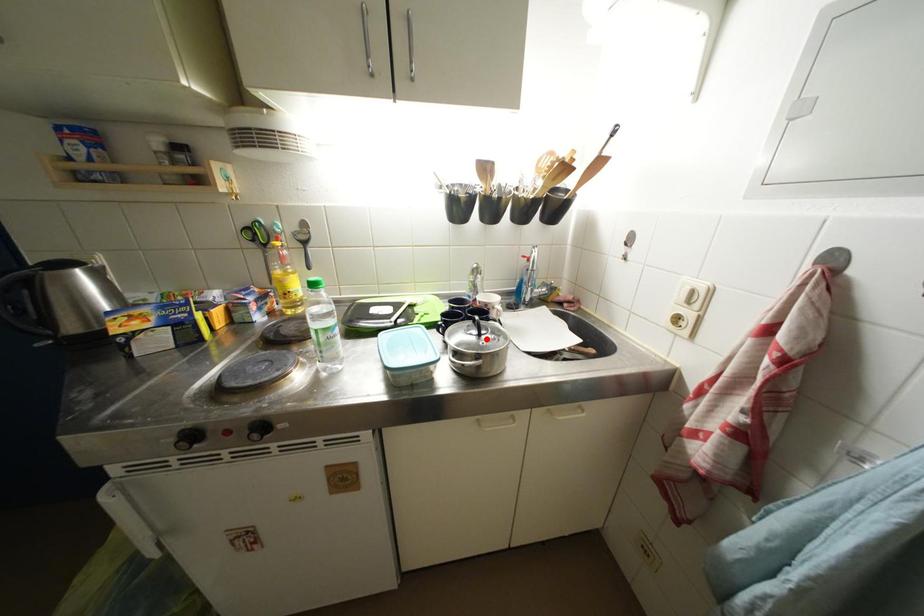
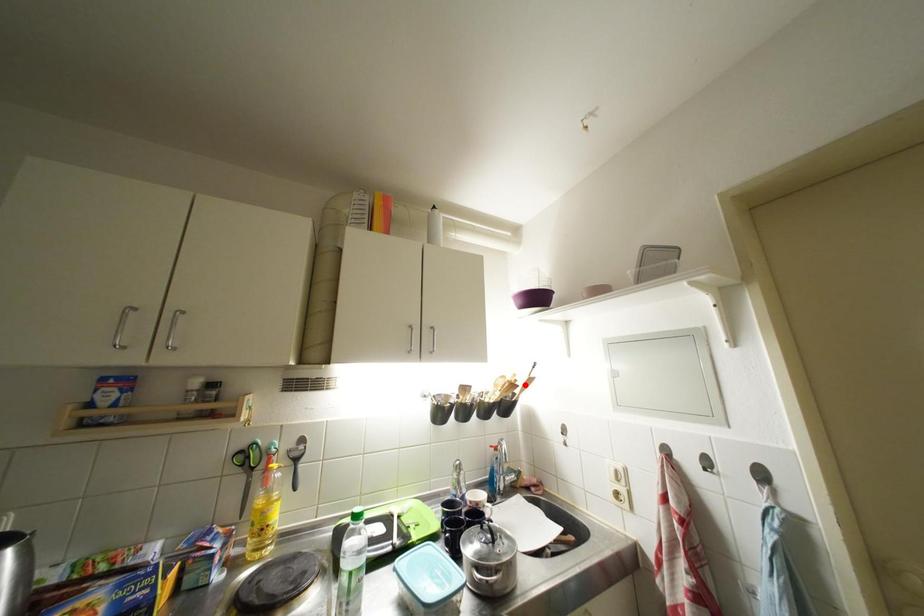
I am providing you with two images of the same scene from different viewpoints. A red point is marked on the first image and another point is marked on the second image. Does the point marked in image1 correspond to the same location as the one in image2?

No